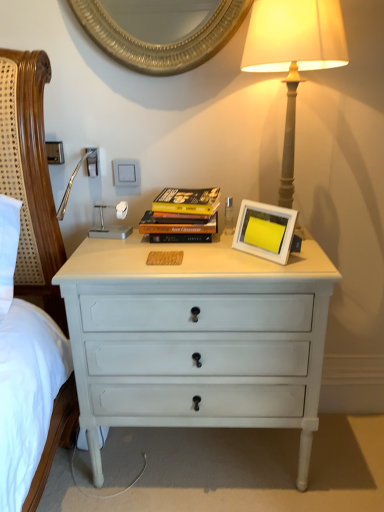
Locate an element on the screen. The width and height of the screenshot is (384, 512). vacant area on top of white painted wood chest of drawers at center (from a real-world perspective) is located at coordinates (186, 247).